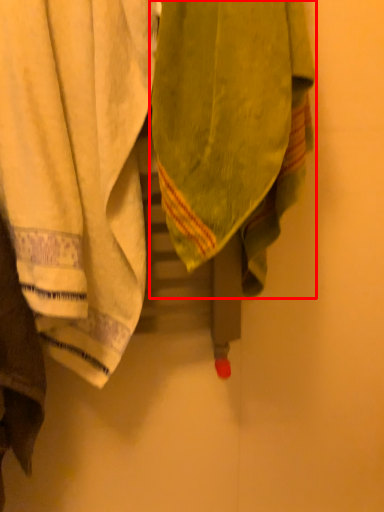
Question: Considering the relative positions of towel (annotated by the red box) and towel in the image provided, where is towel (annotated by the red box) located with respect to the staircase?

Choices:
 (A) right
 (B) left

Answer: (A)